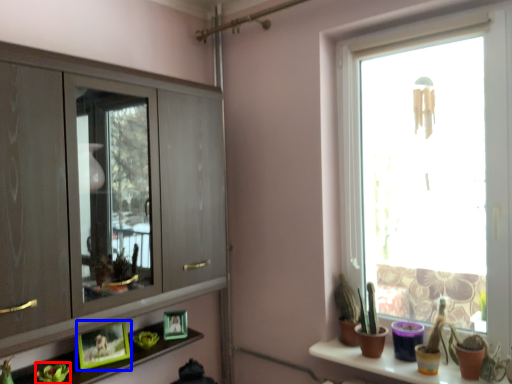
Question: Among these objects, which one is nearest to the camera, plant (highlighted by a red box) or picture frame (highlighted by a blue box)?

Choices:
 (A) plant
 (B) picture frame

Answer: (A)